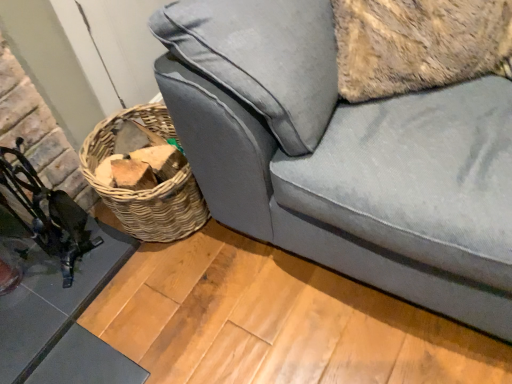
Question: Looking at their shapes, would you say glassy black table at lower left is wider or thinner than metallic black swivel chair at left?

Choices:
 (A) thin
 (B) wide

Answer: (B)

Question: Which is correct: glassy black table at lower left is inside metallic black swivel chair at left, or outside of it?

Choices:
 (A) inside
 (B) outside

Answer: (B)

Question: Estimate the real-world distances between objects in this image. Which object is closer to the velvet gray couch at lower right?

Choices:
 (A) woven brown basket at lower left
 (B) metallic black swivel chair at left
 (C) glassy black table at lower left

Answer: (A)

Question: Which of these objects is positioned farthest from the woven brown basket at lower left?

Choices:
 (A) metallic black swivel chair at left
 (B) velvet gray couch at lower right
 (C) glassy black table at lower left

Answer: (B)